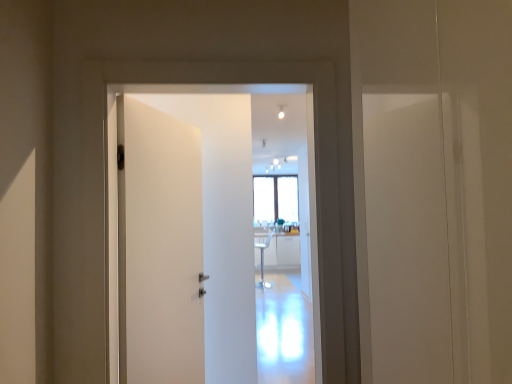
I want to click on white matte door at center, so click(x=316, y=168).

What do you see at coordinates (316, 168) in the screenshot? The width and height of the screenshot is (512, 384). I see `white matte door at center` at bounding box center [316, 168].

Describe the element at coordinates (281, 114) in the screenshot. I see `white glossy light bulb at upper center` at that location.

This screenshot has height=384, width=512. I want to click on white glossy light bulb at upper center, so click(281, 114).

Where is `white matte door at center`? white matte door at center is located at coordinates (316, 168).

Looking at this image, is white matte door at center at the left side of white glossy light bulb at upper center?

Yes.

Considering their positions, is white matte door at center located in front of or behind white glossy light bulb at upper center?

Clearly, white matte door at center is in front of white glossy light bulb at upper center.

Is point (267, 81) closer or farther from the camera than point (278, 113)?

Point (267, 81) is positioned closer to the camera compared to point (278, 113).

From the image's perspective, is white matte door at center below white glossy light bulb at upper center?

Correct, white matte door at center appears lower than white glossy light bulb at upper center in the image.

From a real-world perspective, between white matte door at center and white glossy light bulb at upper center, who is vertically lower?

white matte door at center, from a real-world perspective.

Looking at their sizes, would you say white matte door at center is wider or thinner than white glossy light bulb at upper center?

white matte door at center is wider than white glossy light bulb at upper center.

Between white matte door at center and white glossy light bulb at upper center, which one has less height?

With less height is white glossy light bulb at upper center.

Does white matte door at center have a smaller size compared to white glossy light bulb at upper center?

No.

Is white matte door at center situated inside white glossy light bulb at upper center or outside?

white matte door at center cannot be found inside white glossy light bulb at upper center.

Are white matte door at center and white glossy light bulb at upper center beside each other?

white matte door at center is not next to white glossy light bulb at upper center, and they're not touching.

Is white matte door at center turned away from white glossy light bulb at upper center?

That's right, white matte door at center is facing away from white glossy light bulb at upper center.

What's the angular difference between white matte door at center and white glossy light bulb at upper center's facing directions?

1.55 degrees separate the facing orientations of white matte door at center and white glossy light bulb at upper center.

The image size is (512, 384). I want to click on light above the white matte door at center (from a real-world perspective), so click(281, 114).

Would you say white glossy light bulb at upper center is to the left or to the right of white matte door at center in the picture?

In the image, white glossy light bulb at upper center appears on the right side of white matte door at center.

Between white glossy light bulb at upper center and white matte door at center, which one is positioned behind?

Positioned behind is white glossy light bulb at upper center.

Which is behind, point (282, 110) or point (314, 73)?

Point (282, 110)

From the image's perspective, which one is positioned higher, white glossy light bulb at upper center or white matte door at center?

white glossy light bulb at upper center is shown above in the image.

From a real-world perspective, who is located higher, white glossy light bulb at upper center or white matte door at center?

white glossy light bulb at upper center, from a real-world perspective.

Which object is thinner, white glossy light bulb at upper center or white matte door at center?

With smaller width is white glossy light bulb at upper center.

Considering the sizes of objects white glossy light bulb at upper center and white matte door at center in the image provided, who is taller, white glossy light bulb at upper center or white matte door at center?

white matte door at center is taller.

Considering the sizes of objects white glossy light bulb at upper center and white matte door at center in the image provided, who is bigger, white glossy light bulb at upper center or white matte door at center?

white matte door at center is bigger.

Do you think white glossy light bulb at upper center is within white matte door at center, or outside of it?

white glossy light bulb at upper center is outside white matte door at center.

In the scene shown: Can you see white glossy light bulb at upper center touching white matte door at center?

white glossy light bulb at upper center and white matte door at center are clearly separated.

Is white glossy light bulb at upper center aimed at white matte door at center?

Yes, white glossy light bulb at upper center faces towards white matte door at center.

How many degrees apart are the facing directions of white glossy light bulb at upper center and white matte door at center?

1.55 degrees separate the facing orientations of white glossy light bulb at upper center and white matte door at center.

This screenshot has height=384, width=512. I want to click on door that appears below the white glossy light bulb at upper center (from a real-world perspective), so click(x=316, y=168).

Find the location of `light above the white matte door at center (from a real-world perspective)`. light above the white matte door at center (from a real-world perspective) is located at coordinates (281, 114).

Where is `door on the left of white glossy light bulb at upper center`? The image size is (512, 384). door on the left of white glossy light bulb at upper center is located at coordinates (316, 168).